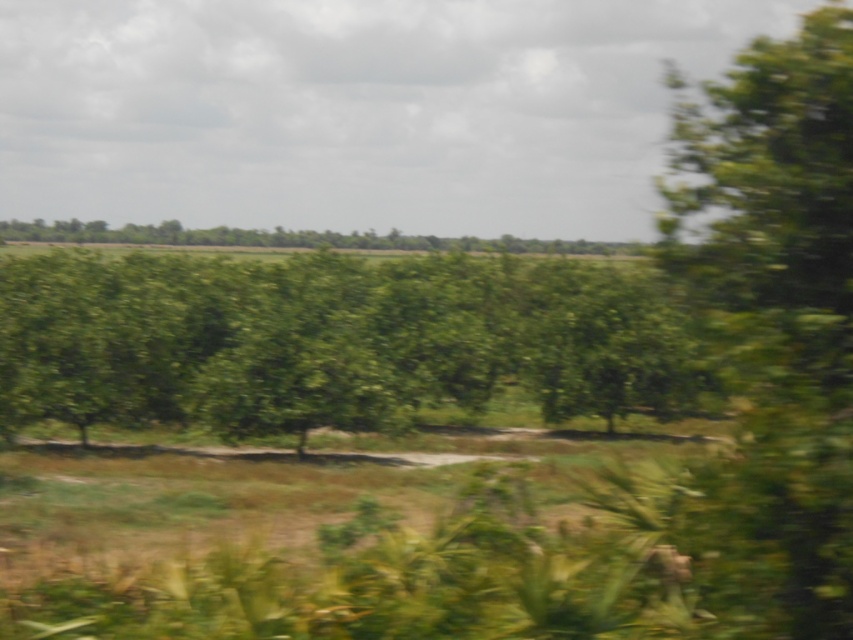
You are standing at the origin point in the rural landscape. The green leafy tree at center is marked at coordinates. Can you determine its exact location based on the provided coordinates?

The green leafy tree at center is located exactly at the coordinates point (329, 340).

You are standing at point (x=744, y=349) and want to walk towards point (x=532, y=280). Will you be moving towards the background or the foreground of the image?

Since point (x=532, y=280) is behind point (x=744, y=349), walking towards it would mean moving towards the background of the image.